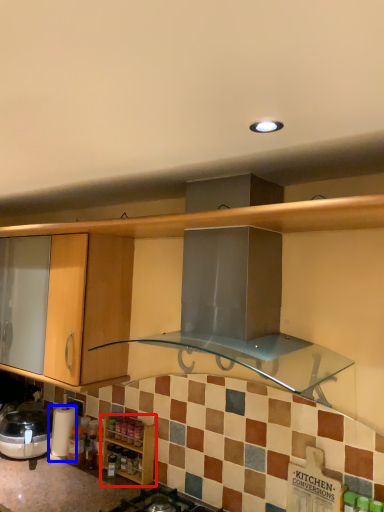
Question: Among these objects, which one is nearest to the camera, cabinetry (highlighted by a red box) or appliance (highlighted by a blue box)?

Choices:
 (A) cabinetry
 (B) appliance

Answer: (A)